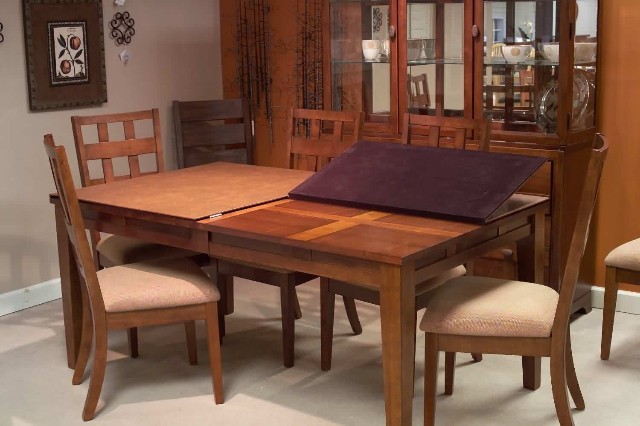
At what (x,y) coordinates should I click in order to perform the action: click on items on shelves. Please return your answer as a coordinate pair (x, y). The width and height of the screenshot is (640, 426). Looking at the image, I should click on (368, 46), (441, 57), (511, 49), (544, 58), (547, 110).